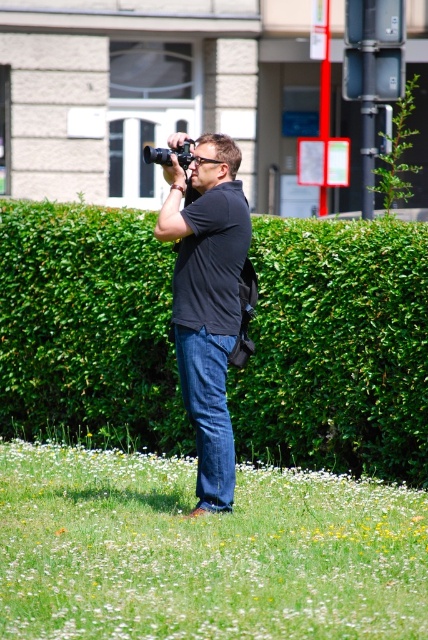
You are a photographer trying to position yourself closer to the two points in the image. The first point is at coordinate point (125,438) and the second is at point (171,236). Which point should you move towards first to get closer to both points?

You should move towards point (125,438) first because it is closer to you than point (171,236), so moving towards it will also bring you nearer to the other point.

You are a photographer standing at the point marked as point (x=208, y=301). What is the color of the shirt you are wearing?

The black matte shirt at center is located at point (x=208, y=301), so the shirt you are wearing is black.